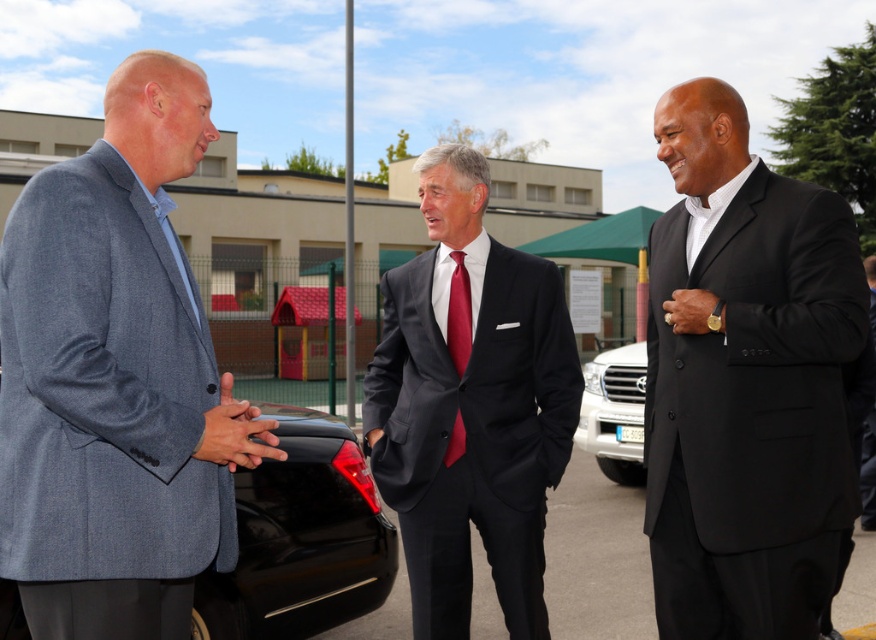
Question: Does gray wool blazer at left appear over white metallic suv at center?

Choices:
 (A) no
 (B) yes

Answer: (B)

Question: Which object appears closest to the camera in this image?

Choices:
 (A) white metallic suv at center
 (B) shiny black car at lower left

Answer: (B)

Question: Which of the following is the farthest from the observer?

Choices:
 (A) (206, 323)
 (B) (434, 250)
 (C) (274, 564)
 (D) (615, 426)

Answer: (D)

Question: In this image, where is gray wool blazer at left located relative to matte black suit at center?

Choices:
 (A) left
 (B) right

Answer: (A)

Question: Among these objects, which one is nearest to the camera?

Choices:
 (A) gray wool blazer at left
 (B) matte black suit at center
 (C) black smooth suit at right

Answer: (A)

Question: Can you confirm if black smooth suit at right is positioned below shiny silk tie at center?

Choices:
 (A) no
 (B) yes

Answer: (B)